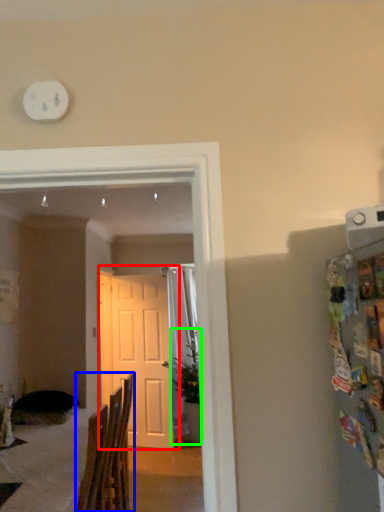
Question: Which object is the farthest from door (highlighted by a red box)? Choose among these: chair (highlighted by a blue box) or houseplant (highlighted by a green box).

Choices:
 (A) chair
 (B) houseplant

Answer: (A)